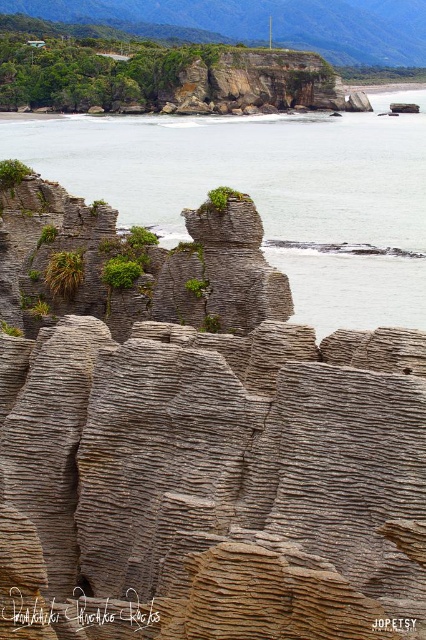
Question: Which object is closer to the camera taking this photo?

Choices:
 (A) green leafy shrub at left
 (B) brown textured rock formation at center

Answer: (B)

Question: Is brown textured rock formation at center below gray/rocky water at center?

Choices:
 (A) yes
 (B) no

Answer: (A)

Question: Can you confirm if brown textured rock formation at center is smaller than green leafy plant at center?

Choices:
 (A) yes
 (B) no

Answer: (B)

Question: Is the position of brown textured rock formation at center more distant than that of gray/rocky water at center?

Choices:
 (A) no
 (B) yes

Answer: (A)

Question: Which of the following is the farthest from the observer?

Choices:
 (A) green leafy shrub at left
 (B) green leafy plant at center

Answer: (A)

Question: Which of the following is the farthest from the observer?

Choices:
 (A) 344,141
 (B) 109,216
 (C) 28,170
 (D) 66,292

Answer: (A)